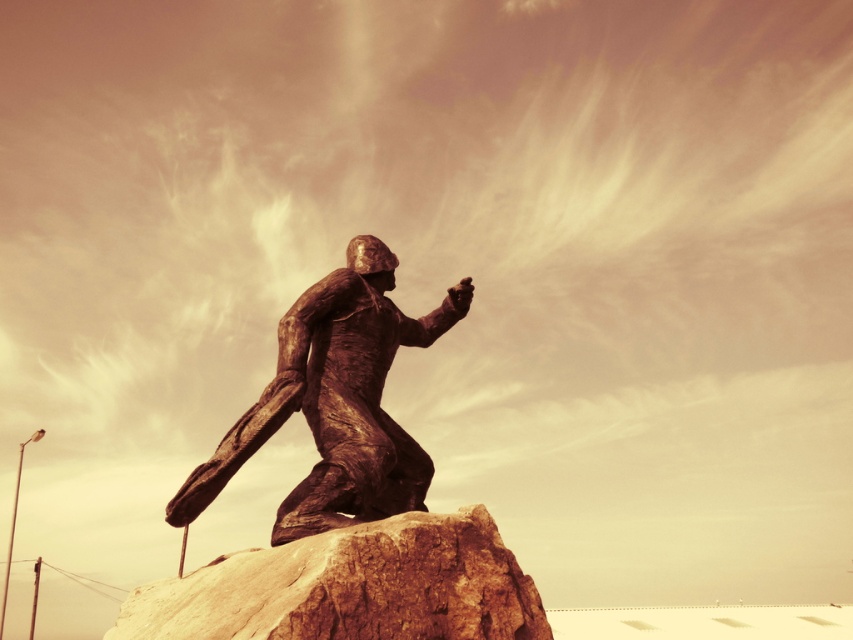
How far apart are rusty stone boulder at center and bronze statue at center?

A distance of 21.37 feet exists between rusty stone boulder at center and bronze statue at center.

Does rusty stone boulder at center come behind bronze statue at center?

No, rusty stone boulder at center is closer to the viewer.

Which is behind, point (254, 609) or point (318, 397)?

The point (318, 397) is behind.

The width and height of the screenshot is (853, 640). In order to click on rusty stone boulder at center in this screenshot , I will do `click(351, 588)`.